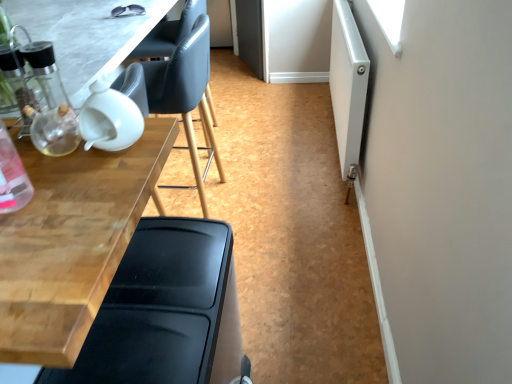
Question: Considering the relative positions of white matte screen door at right and black plastic chair at lower left, marked as the first chair in a front-to-back arrangement, in the image provided, is white matte screen door at right to the left of black plastic chair at lower left, marked as the first chair in a front-to-back arrangement, from the viewer's perspective?

Choices:
 (A) yes
 (B) no

Answer: (B)

Question: Is white matte screen door at right further to the viewer compared to black plastic chair at lower left, the second chair viewed from the back?

Choices:
 (A) yes
 (B) no

Answer: (A)

Question: Is white matte screen door at right not inside black plastic chair at lower left, which is the 1th chair from bottom to top?

Choices:
 (A) no
 (B) yes

Answer: (B)

Question: Is white matte screen door at right positioned far away from black plastic chair at lower left, the second chair viewed from the back?

Choices:
 (A) no
 (B) yes

Answer: (B)

Question: Would you say white matte screen door at right contains black plastic chair at lower left, the second chair viewed from the back?

Choices:
 (A) yes
 (B) no

Answer: (B)

Question: From a real-world perspective, is wooden table at left, which is the 2th table from top to bottom, positioned above or below matte black chair at upper left, the first chair when ordered from top to bottom?

Choices:
 (A) below
 (B) above

Answer: (B)

Question: In the image, is wooden table at left, which is the 2th table from top to bottom, on the left side or the right side of matte black chair at upper left, the first chair when ordered from top to bottom?

Choices:
 (A) right
 (B) left

Answer: (B)

Question: In terms of width, does wooden table at left, the 1th table in the bottom-to-top sequence, look wider or thinner when compared to matte black chair at upper left, which appears as the 2th chair when viewed from the front?

Choices:
 (A) wide
 (B) thin

Answer: (A)

Question: Considering their positions, is wooden table at left, which is the 2th table from top to bottom, located in front of or behind matte black chair at upper left, which is the 2th chair from bottom to top?

Choices:
 (A) behind
 (B) front

Answer: (B)

Question: Is transparent glass table at upper left, placed as the first table when sorted from top to bottom, in front of or behind black plastic chair at lower left, marked as the 2th chair in a top-to-bottom arrangement, in the image?

Choices:
 (A) behind
 (B) front

Answer: (A)

Question: From the image's perspective, is transparent glass table at upper left, placed as the first table when sorted from top to bottom, positioned above or below black plastic chair at lower left, which is the 1th chair from bottom to top?

Choices:
 (A) above
 (B) below

Answer: (A)

Question: Is point (3, 1) closer or farther from the camera than point (147, 365)?

Choices:
 (A) closer
 (B) farther

Answer: (B)

Question: Is transparent glass table at upper left, placed as the first table when sorted from top to bottom, wider or thinner than black plastic chair at lower left, marked as the 2th chair in a top-to-bottom arrangement?

Choices:
 (A) wide
 (B) thin

Answer: (B)

Question: Which is correct: black plastic chair at lower left, which is the 1th chair from bottom to top, is inside white matte screen door at right, or outside of it?

Choices:
 (A) outside
 (B) inside

Answer: (A)

Question: Does point [155, 256] appear closer or farther from the camera than point [336, 109]?

Choices:
 (A) farther
 (B) closer

Answer: (B)